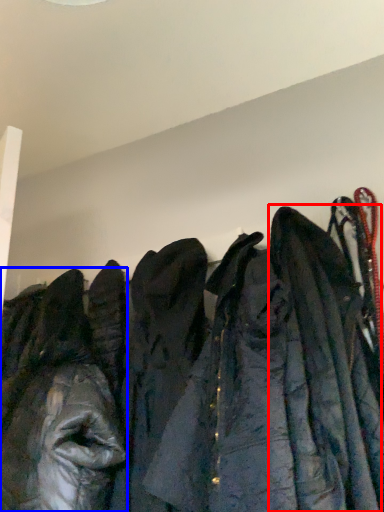
Question: Which point is closer to the camera, cloak (highlighted by a red box) or jacket (highlighted by a blue box)?

Choices:
 (A) cloak
 (B) jacket

Answer: (A)